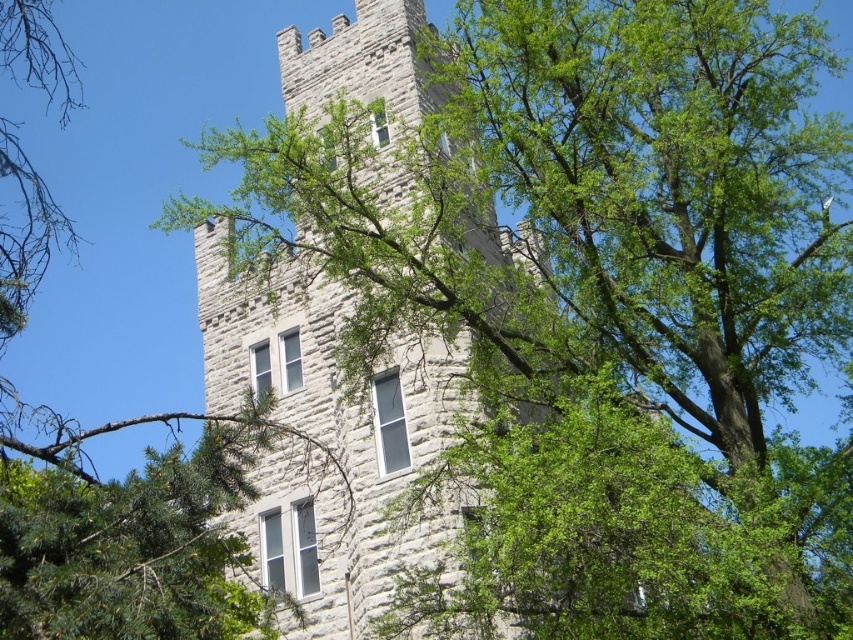
Identify the location of gray stone tower at center. The image size is (853, 640). (329, 438).

Can you confirm if gray stone tower at center is bigger than green leafy tree at center?

Indeed, gray stone tower at center has a larger size compared to green leafy tree at center.

In order to click on gray stone tower at center in this screenshot , I will do coord(329,438).